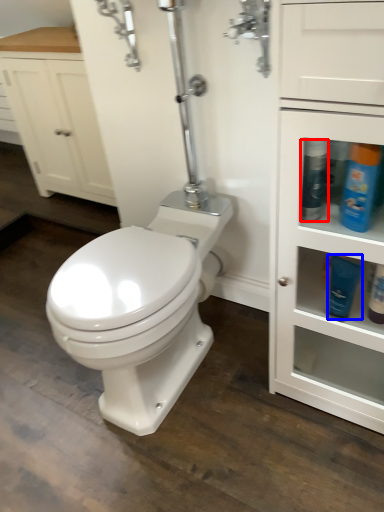
Question: Which object is further to the camera taking this photo, cleaning product (highlighted by a red box) or toiletry (highlighted by a blue box)?

Choices:
 (A) cleaning product
 (B) toiletry

Answer: (B)